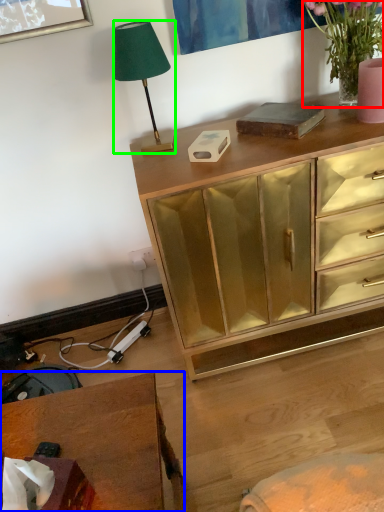
Question: Considering the real-world distances, which object is farthest from houseplant (highlighted by a red box)? desk (highlighted by a blue box) or lamp (highlighted by a green box)?

Choices:
 (A) desk
 (B) lamp

Answer: (A)